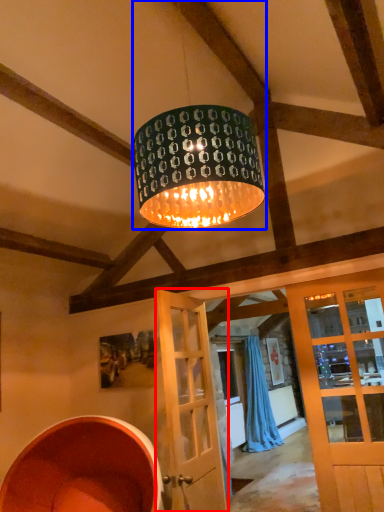
Question: Which of the following is the farthest to the observer, door (highlighted by a red box) or lamp (highlighted by a blue box)?

Choices:
 (A) door
 (B) lamp

Answer: (A)